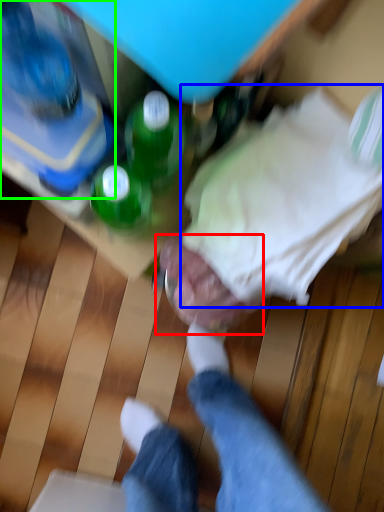
Question: Considering the real-world distances, which object is closest to head (highlighted by a red box)? clothing (highlighted by a blue box) or bottle (highlighted by a green box).

Choices:
 (A) clothing
 (B) bottle

Answer: (A)